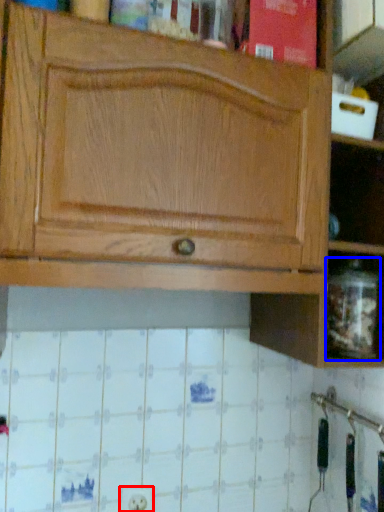
Question: Which object appears closest to the camera in this image, electric outlet (highlighted by a red box) or glass jar (highlighted by a blue box)?

Choices:
 (A) electric outlet
 (B) glass jar

Answer: (B)